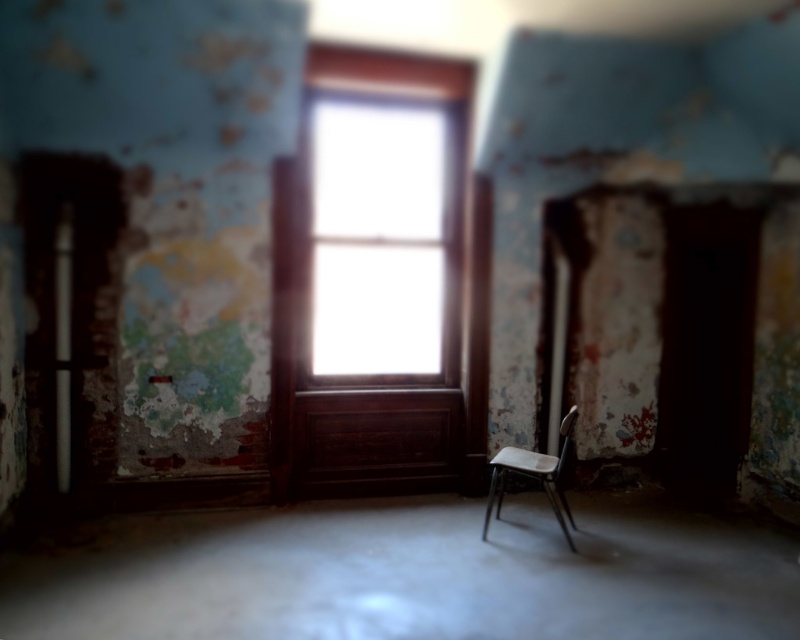
You are standing in the room and want to sit down on the metallic gray chair at center. However, you notice the transparent glass window at center is in your way. Can you move around the window to reach the chair?

The metallic gray chair at center is behind the transparent glass window at center, so you can move around the window to reach the chair by going to either side of the window since the chair is positioned behind it.

You are a delivery person who needs to place a package on the floor between the transparent glass window at center and the metallic gray chair at center. The package is 4 feet long. Will the space between them be sufficient to fit the package horizontally?

The distance between the transparent glass window at center and the metallic gray chair at center is 4.31 feet, which is slightly longer than the 4 feet length of the package. Therefore, the space is sufficient to fit the package horizontally.